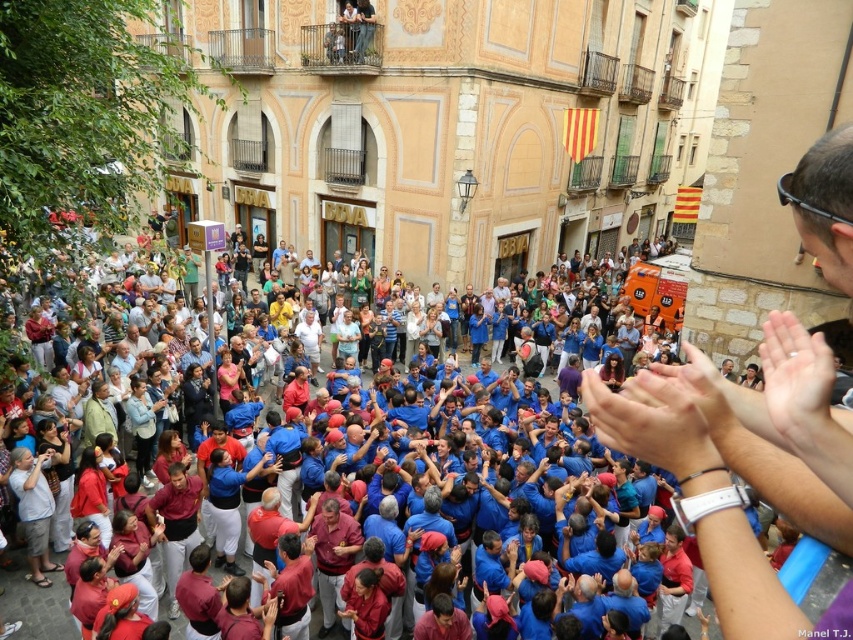
Which is above, matte black watch at upper right or blue fabric crowd at center?

matte black watch at upper right is above.

Can you confirm if matte black watch at upper right is shorter than blue fabric crowd at center?

Yes.

Is point (689, 474) positioned before point (846, 288)?

Yes.

You are a GUI agent. You are given a task and a screenshot of the screen. Output one action in this format:
    pyautogui.click(x=<x>, y=<y>)
    Task: Click on the matte black watch at upper right
    
    Given the screenshot: What is the action you would take?
    pyautogui.click(x=740, y=464)